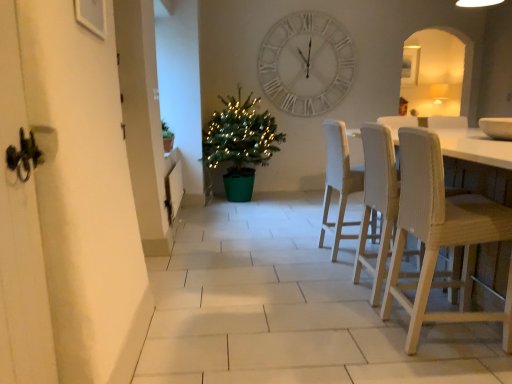
Question: From a real-world perspective, is green plastic potted plant at center positioned under white woven chair at right, which appears as the first chair when viewed from the front, based on gravity?

Choices:
 (A) yes
 (B) no

Answer: (B)

Question: Is green plastic potted plant at center not inside white woven chair at right, which is counted as the 3th chair, starting from the back?

Choices:
 (A) no
 (B) yes

Answer: (B)

Question: Can you confirm if green plastic potted plant at center is taller than white woven chair at right, which appears as the first chair when viewed from the front?

Choices:
 (A) yes
 (B) no

Answer: (A)

Question: Considering the relative sizes of green plastic potted plant at center and white woven chair at right, which is counted as the 3th chair, starting from the back, in the image provided, is green plastic potted plant at center bigger than white woven chair at right, which is counted as the 3th chair, starting from the back,?

Choices:
 (A) yes
 (B) no

Answer: (A)

Question: Can white woven chair at right, which is counted as the 3th chair, starting from the back, be found inside green plastic potted plant at center?

Choices:
 (A) no
 (B) yes

Answer: (A)

Question: From the image's perspective, is green plastic potted plant at center on white woven chair at right, which is counted as the 3th chair, starting from the back?

Choices:
 (A) yes
 (B) no

Answer: (A)

Question: Considering the relative sizes of white matte wall clock at upper center and white fabric chair at center, which is counted as the first chair, starting from the back, in the image provided, is white matte wall clock at upper center bigger than white fabric chair at center, which is counted as the first chair, starting from the back,?

Choices:
 (A) no
 (B) yes

Answer: (A)

Question: Is white matte wall clock at upper center at the right side of white fabric chair at center, which is counted as the first chair, starting from the back?

Choices:
 (A) no
 (B) yes

Answer: (A)

Question: From the image's perspective, is white matte wall clock at upper center over white fabric chair at center, acting as the third chair starting from the front?

Choices:
 (A) yes
 (B) no

Answer: (A)

Question: Is white matte wall clock at upper center taller than white fabric chair at center, acting as the third chair starting from the front?

Choices:
 (A) yes
 (B) no

Answer: (A)

Question: Considering the relative sizes of white matte wall clock at upper center and white fabric chair at center, acting as the third chair starting from the front, in the image provided, is white matte wall clock at upper center shorter than white fabric chair at center, acting as the third chair starting from the front,?

Choices:
 (A) no
 (B) yes

Answer: (A)

Question: Is white matte wall clock at upper center to the left of white fabric chair at center, which is counted as the first chair, starting from the back, from the viewer's perspective?

Choices:
 (A) no
 (B) yes

Answer: (B)

Question: Can green plastic potted plant at center be found inside white matte wall clock at upper center?

Choices:
 (A) yes
 (B) no

Answer: (B)